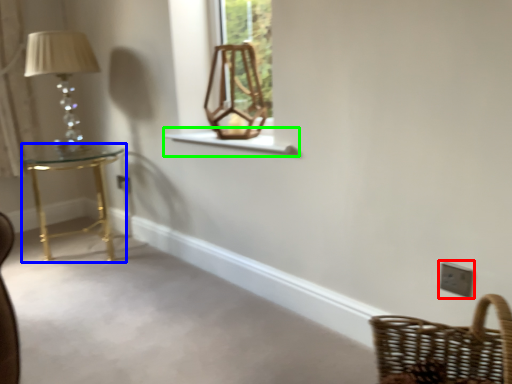
Question: Based on their relative distances, which object is nearer to light switch (highlighted by a red box)? Choose from table (highlighted by a blue box) and window sill (highlighted by a green box).

Choices:
 (A) table
 (B) window sill

Answer: (B)